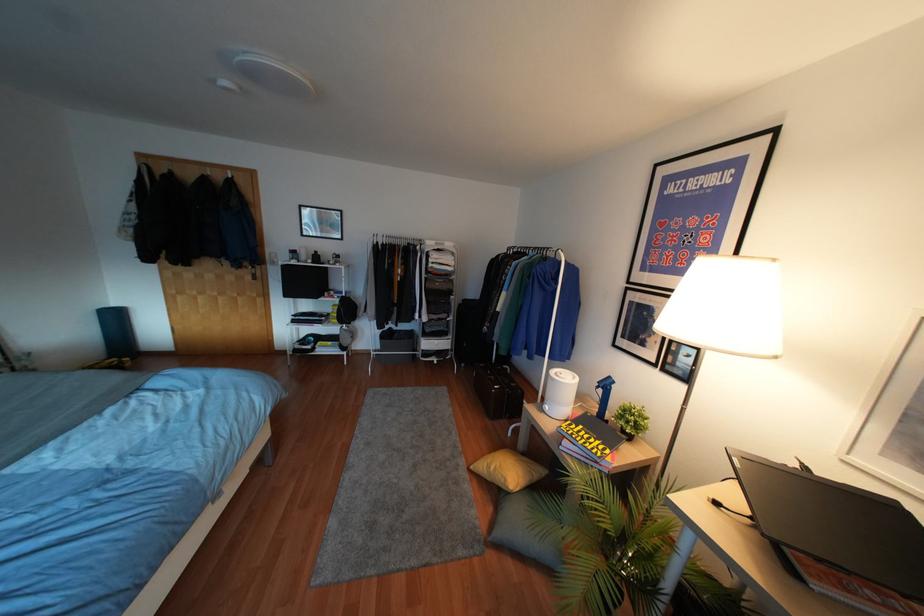
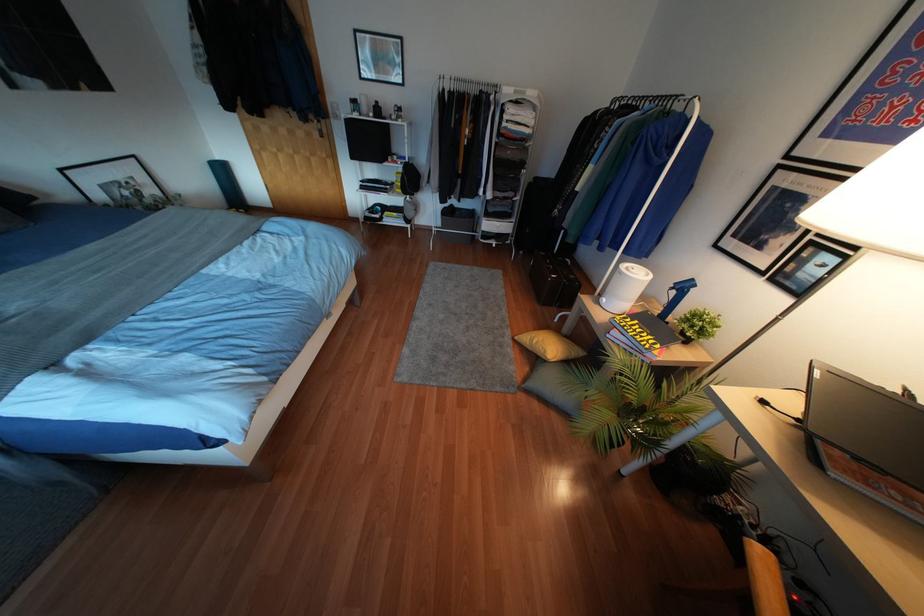
The point at (609,377) is marked in the first image. Where is the corresponding point in the second image?

(690, 280)